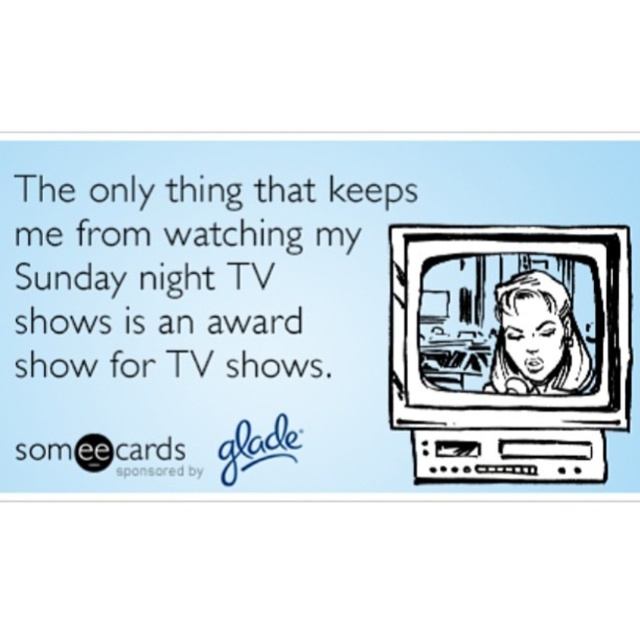
Question: Is black ink drawing of a woman at center in front of smooth black hair at center?

Choices:
 (A) yes
 (B) no

Answer: (A)

Question: Among these objects, which one is farthest from the camera?

Choices:
 (A) smooth black hair at center
 (B) black ink drawing of a woman at center

Answer: (A)

Question: Can you confirm if black ink drawing of a woman at center is wider than smooth black hair at center?

Choices:
 (A) yes
 (B) no

Answer: (A)

Question: Which of the following is the closest to the observer?

Choices:
 (A) black ink drawing of a woman at center
 (B) smooth black hair at center

Answer: (A)

Question: Can you confirm if black ink drawing of a woman at center is wider than smooth black hair at center?

Choices:
 (A) yes
 (B) no

Answer: (A)